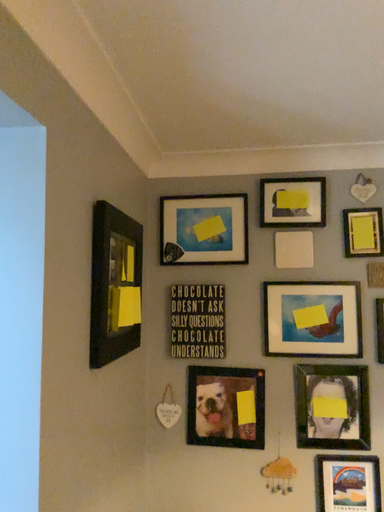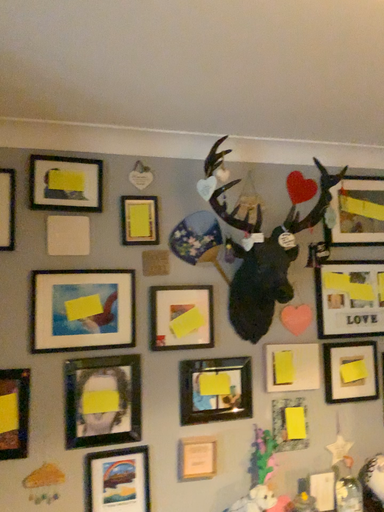
Question: Which way did the camera rotate in the video?

Choices:
 (A) rotated right
 (B) rotated left

Answer: (A)